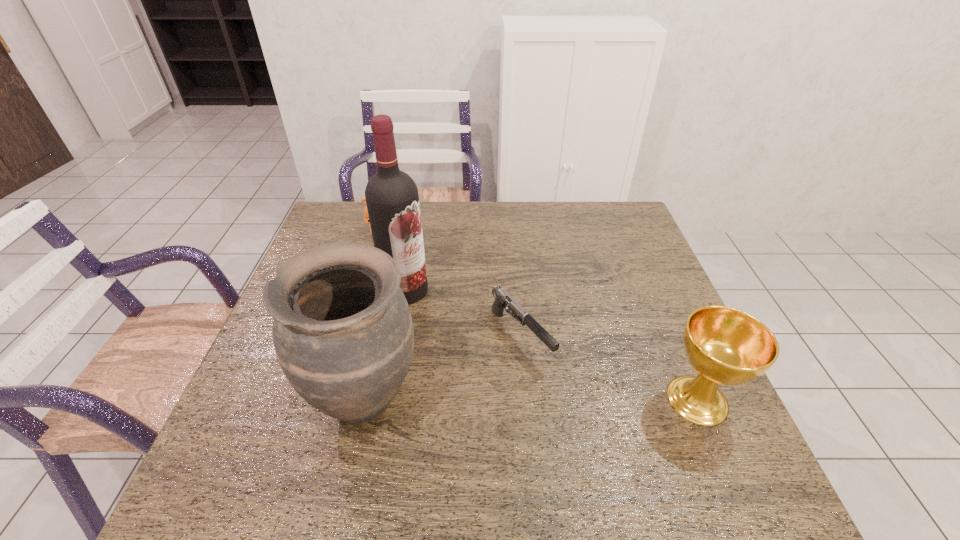
The image size is (960, 540). Identify the location of free point at the near edge. (439, 437).

Find the location of a particular element. vacant region at the left edge of the desktop is located at coordinates (277, 372).

The width and height of the screenshot is (960, 540). In the image, there is a desktop. What are the coordinates of `free space at the right edge` in the screenshot? It's located at (666, 408).

Find the location of `free region at the far left corner of the desktop`. free region at the far left corner of the desktop is located at coordinates (345, 208).

Locate an element on the screen. Image resolution: width=960 pixels, height=540 pixels. free point at the near left corner is located at coordinates (287, 412).

Identify the location of free region at the near right corner of the desktop. This screenshot has width=960, height=540. (680, 444).

The height and width of the screenshot is (540, 960). I want to click on unoccupied area between the shortest object and the tallest object, so click(464, 313).

Locate an element on the screen. unoccupied position between the chalice and the fourth tallest object is located at coordinates (540, 317).

Identify the location of vacant area between the third shortest object and the second tallest object. The image size is (960, 540). (531, 400).

At what (x,y) coordinates should I click in order to perform the action: click on vacant area between the fourth nearest object and the shortest object. Please return your answer as a coordinate pair (x, y). Looking at the image, I should click on (464, 313).